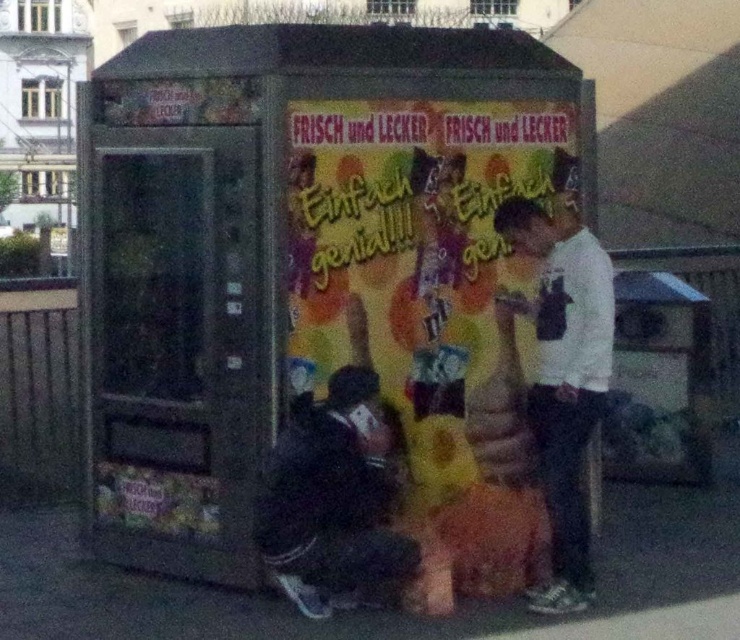
Question: Which object is the farthest from the metallic gray vending machine at center?

Choices:
 (A) white matte shirt at center
 (B) black fabric squat at lower center

Answer: (A)

Question: Among these points, which one is farthest from the camera?

Choices:
 (A) (457, 339)
 (B) (289, 560)
 (C) (562, 266)

Answer: (A)

Question: Can you confirm if black fabric squat at lower center is positioned below white matte shirt at center?

Choices:
 (A) yes
 (B) no

Answer: (A)

Question: Does metallic gray vending machine at center have a smaller size compared to white matte shirt at center?

Choices:
 (A) no
 (B) yes

Answer: (A)

Question: Estimate the real-world distances between objects in this image. Which object is closer to the white matte shirt at center?

Choices:
 (A) black fabric squat at lower center
 (B) metallic gray vending machine at center

Answer: (B)

Question: Is black fabric squat at lower center positioned in front of white matte shirt at center?

Choices:
 (A) yes
 (B) no

Answer: (A)